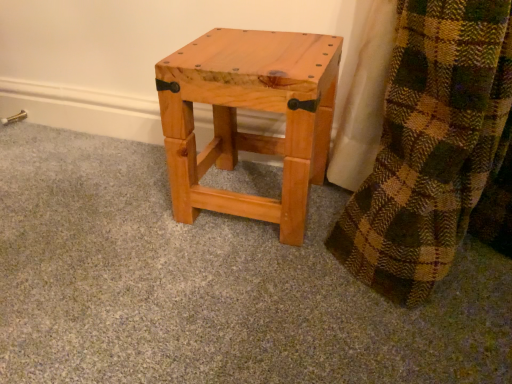
In order to click on vacant space situated on the left part of natural wood stool at center in this screenshot , I will do `click(124, 199)`.